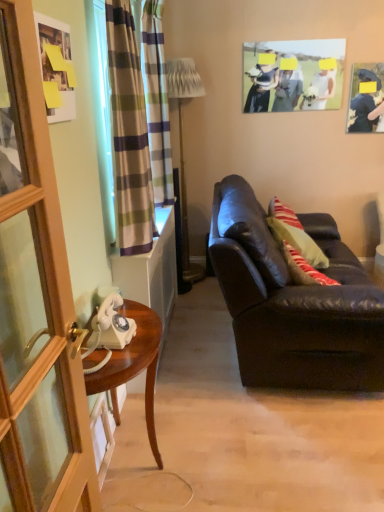
Find the location of a particular element. vacant space in wooden desk at left (from a real-world perspective) is located at coordinates (137, 476).